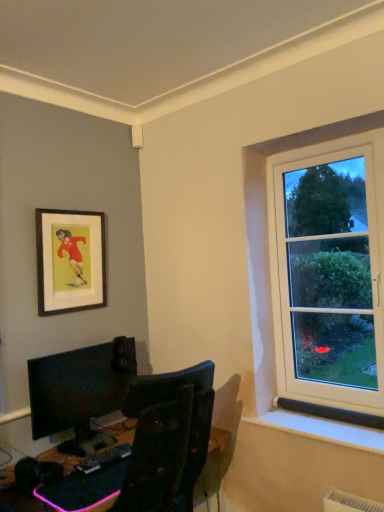
Question: Would you say wooden framed poster at upper left is inside or outside black plastic desk at lower left?

Choices:
 (A) outside
 (B) inside

Answer: (A)

Question: From the image's perspective, relative to black plastic desk at lower left, is wooden framed poster at upper left above or below?

Choices:
 (A) above
 (B) below

Answer: (A)

Question: Estimate the real-world distances between objects in this image. Which object is closer to the black plastic keyboard at lower center?

Choices:
 (A) black plastic desk at lower left
 (B) wooden framed poster at upper left
 (C) matte black monitor at lower left

Answer: (A)

Question: Considering the real-world distances, which object is farthest from the wooden framed poster at upper left?

Choices:
 (A) matte black monitor at lower left
 (B) black plastic desk at lower left
 (C) black plastic keyboard at lower center

Answer: (C)